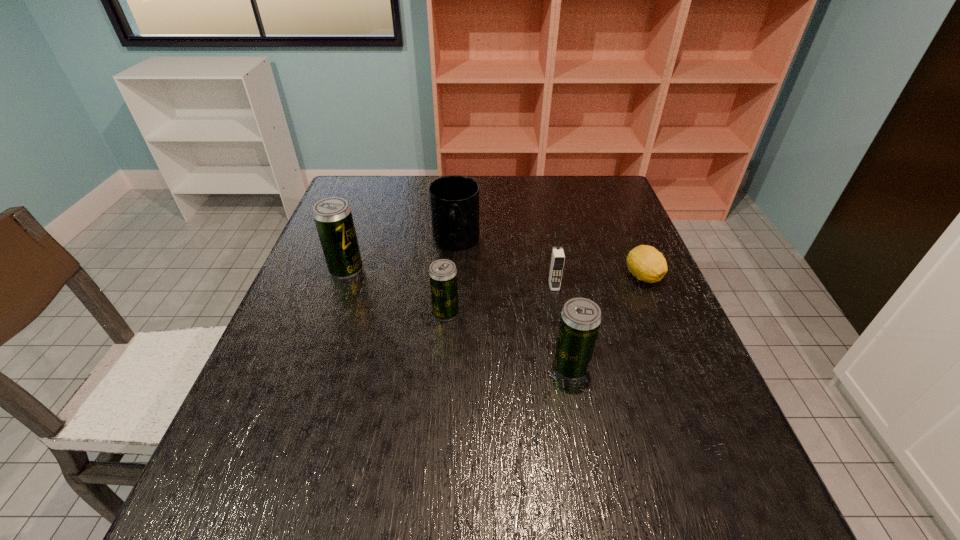
Locate an element on the screen. The image size is (960, 540). vacant space located 0.210m on the right of the leftmost object is located at coordinates click(444, 269).

I want to click on vacant space located on the back of the second beer can from right to left, so click(x=450, y=256).

Identify the location of free space located on the back of the rightmost beer can. (564, 335).

This screenshot has width=960, height=540. In order to click on vacant space located 0.080m on the front-facing side of the cellular telephone in this screenshot , I will do `click(560, 315)`.

Find the location of a particular element. blank space located on the side of the mug with the handle is located at coordinates (449, 332).

Where is `free space located 0.260m at the stem end of the rightmost object`? The width and height of the screenshot is (960, 540). free space located 0.260m at the stem end of the rightmost object is located at coordinates (686, 380).

Identify the location of object present at the left edge. (333, 218).

At what (x,y) coordinates should I click in order to perform the action: click on object that is positioned at the right edge. Please return your answer as a coordinate pair (x, y). This screenshot has width=960, height=540. Looking at the image, I should click on (646, 263).

You are a GUI agent. You are given a task and a screenshot of the screen. Output one action in this format:
    pyautogui.click(x=<x>, y=<y>)
    Task: Click on the vacant area at the far edge of the desktop
    The width and height of the screenshot is (960, 540).
    Given the screenshot: What is the action you would take?
    pyautogui.click(x=399, y=205)

Where is `vacant region at the near edge of the desktop`? The width and height of the screenshot is (960, 540). vacant region at the near edge of the desktop is located at coordinates (357, 440).